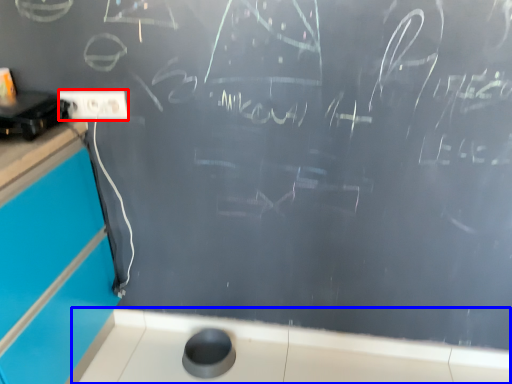
Question: Which point is closer to the camera, electric outlet (highlighted by a red box) or counter top (highlighted by a blue box)?

Choices:
 (A) electric outlet
 (B) counter top

Answer: (A)